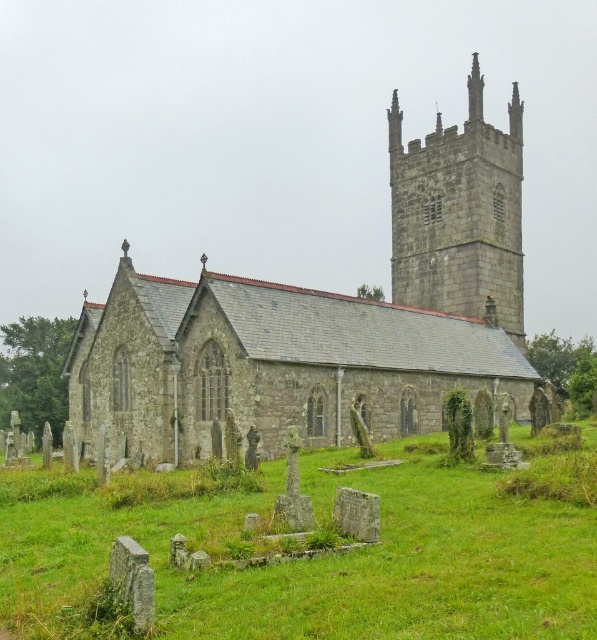
Question: Considering the real-world distances, which object is closest to the stone steeple at upper center?

Choices:
 (A) stone church at center
 (B) green grass at center

Answer: (A)

Question: Which object appears farthest from the camera in this image?

Choices:
 (A) stone church at center
 (B) green grass at center

Answer: (A)

Question: Can you confirm if stone church at center is wider than green grass at center?

Choices:
 (A) no
 (B) yes

Answer: (B)

Question: Does stone church at center appear on the right side of stone steeple at upper center?

Choices:
 (A) yes
 (B) no

Answer: (B)

Question: Among these objects, which one is farthest from the camera?

Choices:
 (A) stone church at center
 (B) stone steeple at upper center
 (C) green grass at center

Answer: (B)

Question: Can you confirm if stone church at center is thinner than stone steeple at upper center?

Choices:
 (A) yes
 (B) no

Answer: (B)